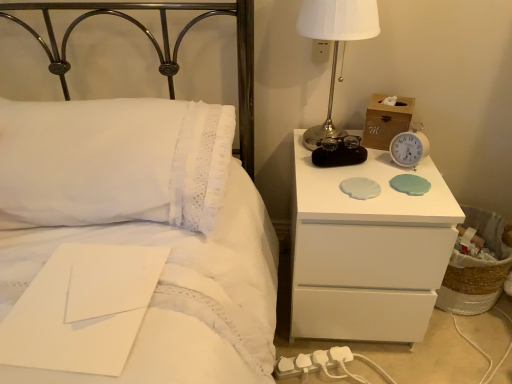
Image resolution: width=512 pixels, height=384 pixels. I want to click on vacant space in front of wooden tissue box at upper right, so click(393, 177).